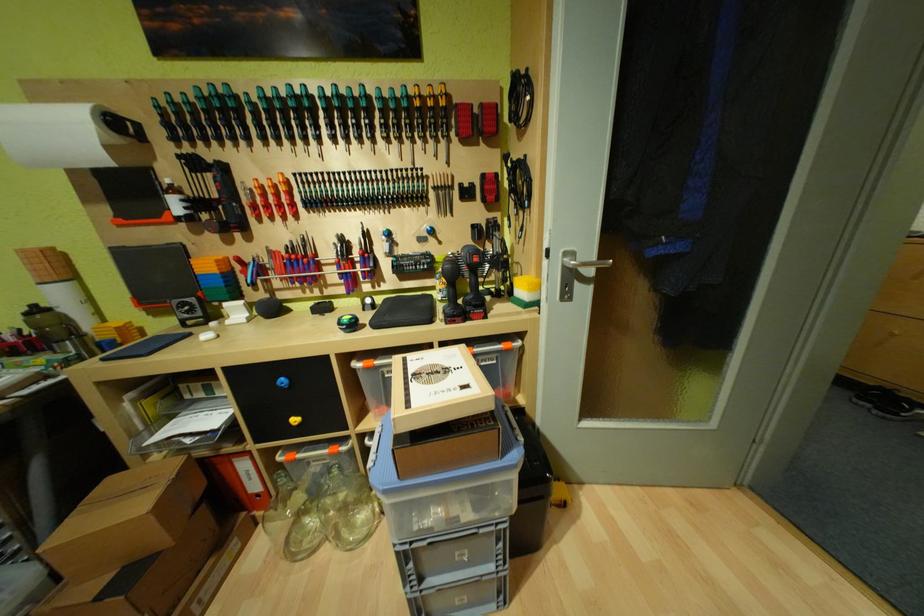
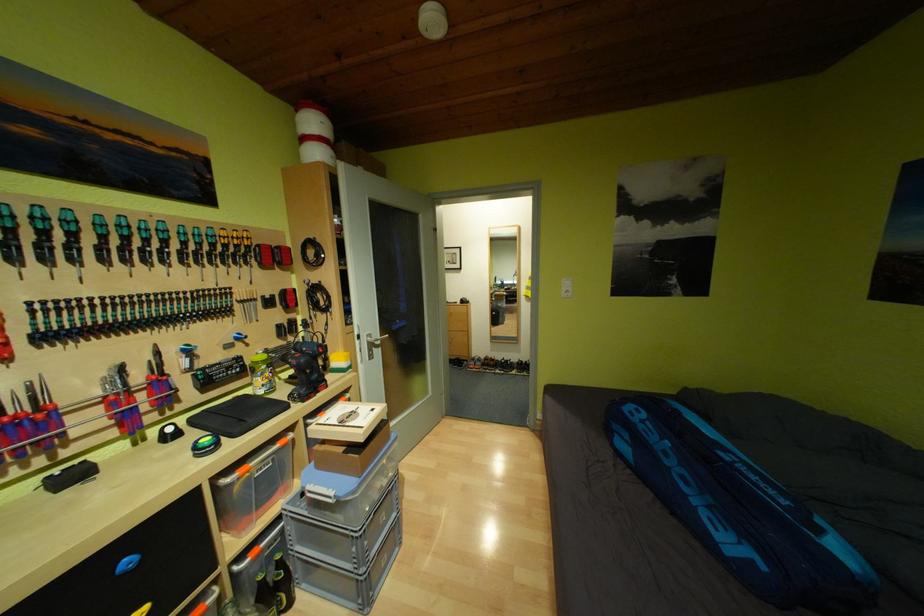
The point at [344,267] is marked in the first image. Where is the corresponding point in the second image?

(111, 408)